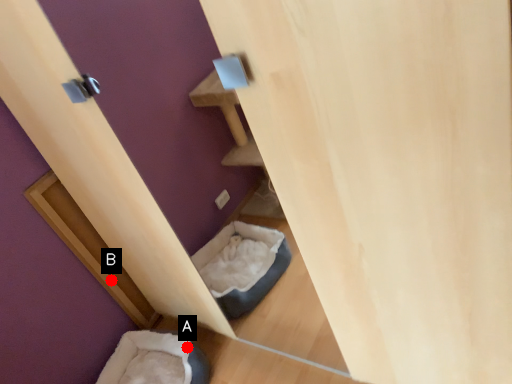
Question: Two points are circled on the image, labeled by A and B beside each circle. Which of the following is the farthest from the observer?

Choices:
 (A) A is further
 (B) B is further

Answer: (B)